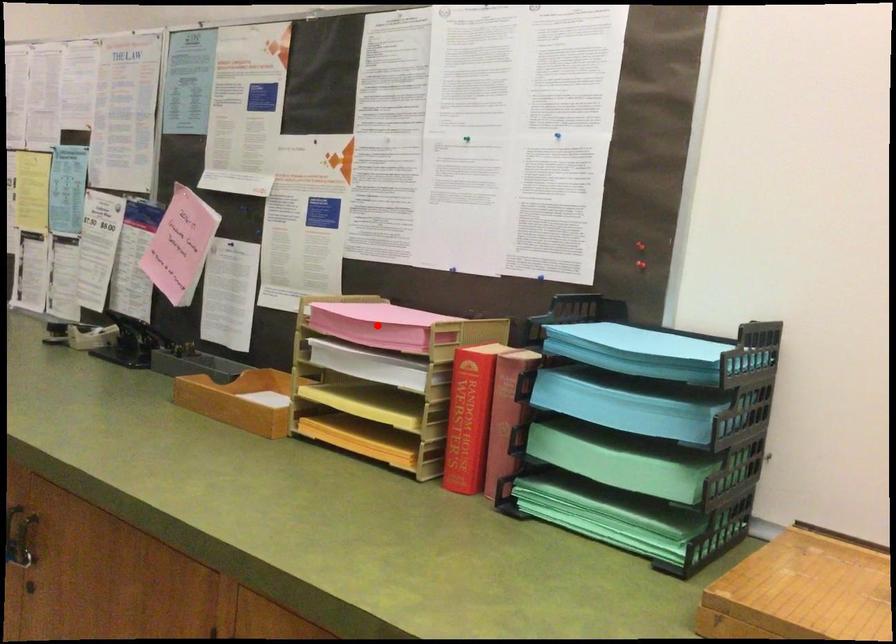
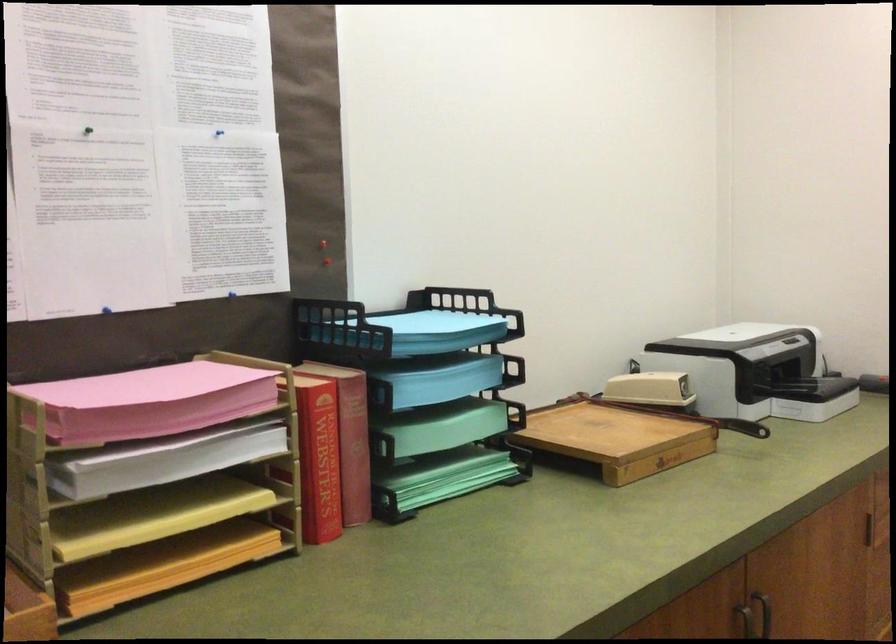
Question: A red point is marked in image1. In image2, is the corresponding 3D point closer to the camera or farther? Reply with the corresponding letter.

Choices:
 (A) The corresponding 3D point is closer.
 (B) The corresponding 3D point is farther.

Answer: (A)